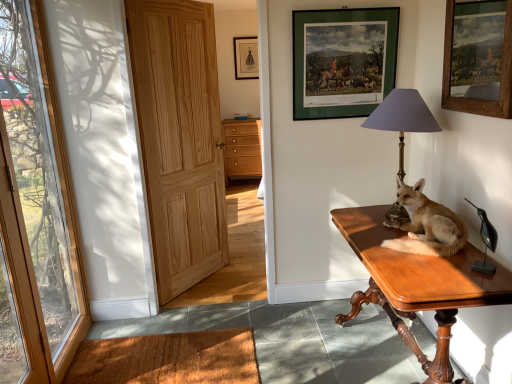
Locate an element on the screen. The image size is (512, 384). unoccupied space behind black glossy bird at right is located at coordinates (462, 255).